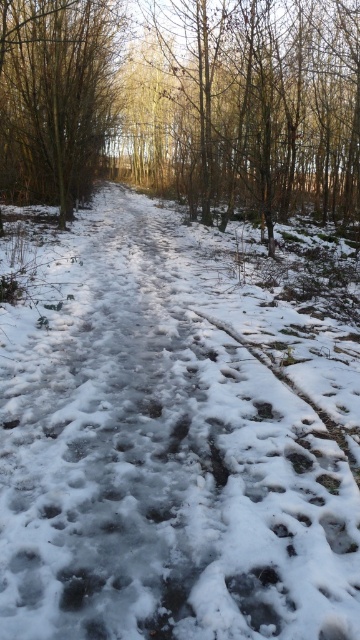
Does point (189, 269) come in front of point (204, 93)?

Yes.

Is point (181, 529) behind point (339, 179)?

No.

You are a GUI agent. You are given a task and a screenshot of the screen. Output one action in this format:
    pyautogui.click(x=<x>, y=<y>)
    Task: Click on the white frosty path at center
    
    Given the screenshot: What is the action you would take?
    pyautogui.click(x=177, y=429)

Can you confirm if white frosty path at center is positioned to the left of brown textured tree at upper left?

In fact, white frosty path at center is to the right of brown textured tree at upper left.

Which is below, white frosty path at center or brown textured tree at upper left?

white frosty path at center is below.

Who is more forward, (200, 573) or (38, 58)?

Positioned in front is point (200, 573).

I want to click on white frosty path at center, so click(177, 429).

Can you confirm if brown/dry wood at upper center is smaller than brown textured tree at upper left?

Actually, brown/dry wood at upper center might be larger than brown textured tree at upper left.

Is point (230, 76) less distant than point (96, 129)?

That is True.

Where is `brown/dry wood at upper center`? This screenshot has width=360, height=640. brown/dry wood at upper center is located at coordinates (266, 102).